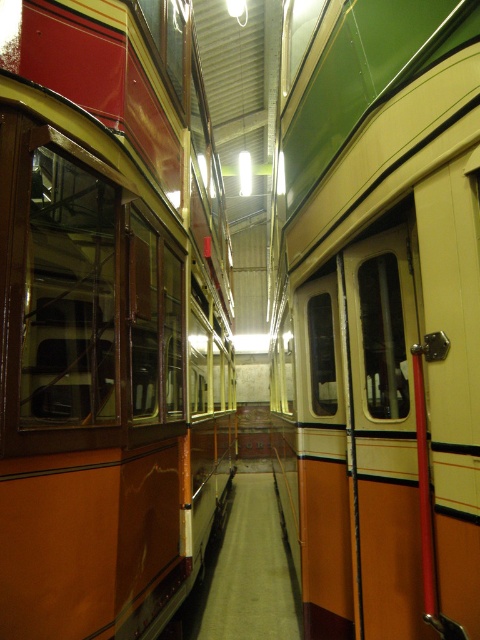
You are a tour guide leading a group through this vintage tram exhibit. You notice a matte orange bus at left and a matte orange door at center. Which object is wider from your current viewpoint?

The matte orange bus at left is wider than the matte orange door at center.

You are a tour guide explaining the layout of the tram. Which object, the matte orange bus at left or the matte orange door at center, takes up more space in the scene?

The matte orange door at center takes up more space in the scene than the matte orange bus at left, as the bus occupies less space than the door.

You are a delivery person carrying a package that is 1.5 meters long. You need to move from the matte orange bus at left to the matte orange door at center. Is there enough space for your package to fit through the gap between them?

The distance between the matte orange bus at left and the matte orange door at center is 1.37 meters, which is shorter than the 1.5 meter package. Therefore, the package cannot fit through the gap between them.